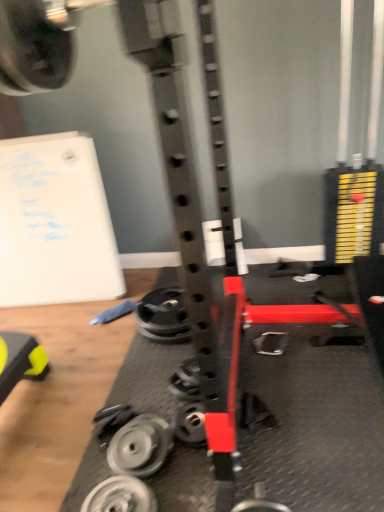
Question: Is point (162, 451) positioned closer to the camera than point (175, 429)?

Choices:
 (A) farther
 (B) closer

Answer: (B)

Question: In the image, is silver metallic weight at center-left, the 2th wheel from the front, positioned in front of or behind metallic silver wheel at center, placed as the second wheel when sorted from back to front?

Choices:
 (A) front
 (B) behind

Answer: (A)

Question: Estimate the real-world distances between objects in this image. Which object is closer to the metallic silver wheel at center, placed as the second wheel when sorted from back to front?

Choices:
 (A) silver metallic weight at lower center, placed as the 4th wheel when sorted from top to bottom
 (B) silver metallic weight at center-left, which is the third wheel in back-to-front order
 (C) metallic silver weight at center, which appears as the fourth wheel when viewed from the front

Answer: (B)

Question: Which of these objects is positioned closest to the silver metallic weight at lower center, marked as the first wheel in a front-to-back arrangement?

Choices:
 (A) silver metallic weight at center-left, which is the second wheel from bottom to top
 (B) metallic silver wheel at center, which is the 3th wheel from bottom to top
 (C) metallic silver weight at center, the fourth wheel in the bottom-to-top sequence

Answer: (A)